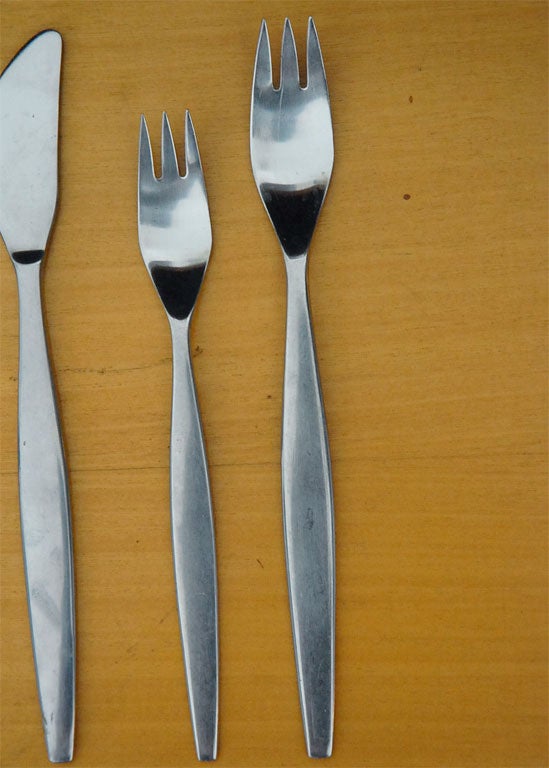
At what (x,y) coordinates should I click in order to perform the action: click on knife handle. Please return your answer as a coordinate pair (x, y). The height and width of the screenshot is (768, 549). Looking at the image, I should click on coord(53,735).